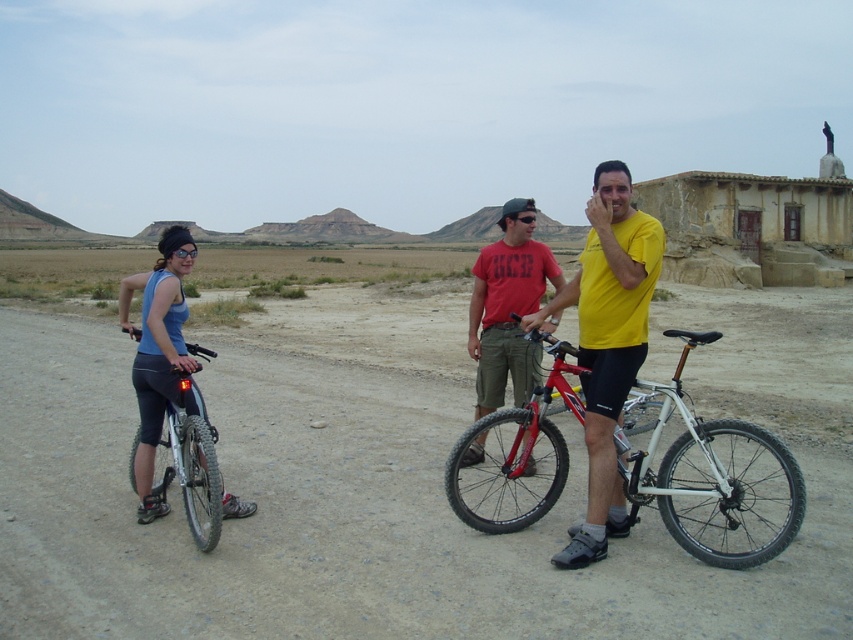
Question: Which object is positioned farthest from the red matte shirt at center?

Choices:
 (A) white matte bicycle at center
 (B) dirt track at center

Answer: (B)

Question: Does white matte bicycle at center appear under matte black bicycle at left?

Choices:
 (A) yes
 (B) no

Answer: (A)

Question: Estimate the real-world distances between objects in this image. Which object is farther from the dirt track at center?

Choices:
 (A) matte blue tank top at left
 (B) white matte bicycle at center
 (C) matte black bicycle at left
 (D) yellow matte shirt at center

Answer: (D)

Question: Can you confirm if white matte bicycle at center is positioned to the right of red matte shirt at center?

Choices:
 (A) no
 (B) yes

Answer: (B)

Question: Based on their relative distances, which object is nearer to the white matte bicycle at center?

Choices:
 (A) red matte shirt at center
 (B) dirt track at center
 (C) yellow matte shirt at center

Answer: (C)

Question: Can you confirm if dirt track at center is smaller than matte blue tank top at left?

Choices:
 (A) yes
 (B) no

Answer: (A)